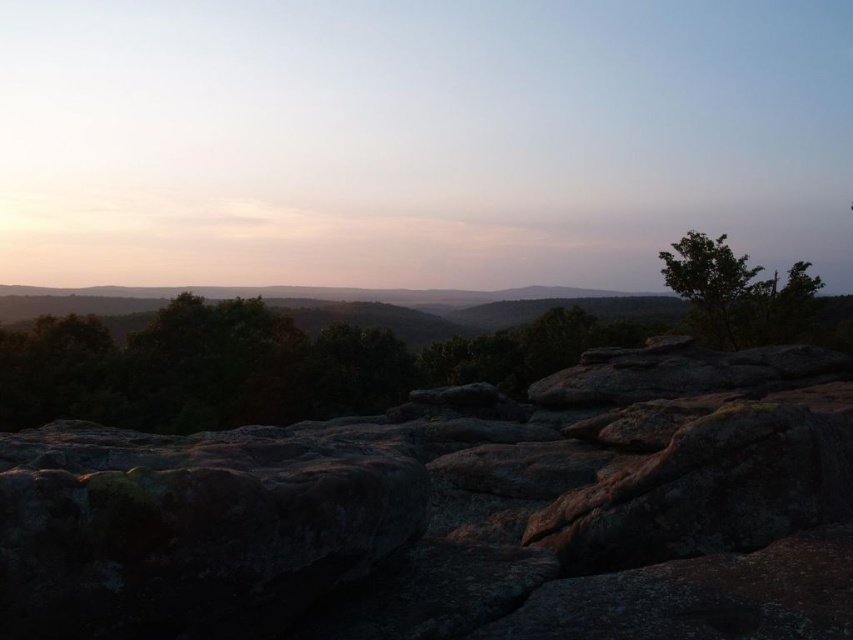
Question: Can you confirm if rusty stone boulder at center is thinner than green leafy tree at center?

Choices:
 (A) yes
 (B) no

Answer: (A)

Question: Considering the real-world distances, which object is closest to the rusty stone boulder at center?

Choices:
 (A) green leafy tree at upper right
 (B) green leafy tree at center

Answer: (A)

Question: Is rusty stone boulder at center positioned behind green leafy tree at center?

Choices:
 (A) no
 (B) yes

Answer: (A)

Question: Which object appears closest to the camera in this image?

Choices:
 (A) green leafy tree at upper right
 (B) rusty stone boulder at center

Answer: (B)

Question: In this image, where is rusty stone boulder at center located relative to green leafy tree at upper right?

Choices:
 (A) below
 (B) above

Answer: (A)

Question: Estimate the real-world distances between objects in this image. Which object is farther from the green leafy tree at upper right?

Choices:
 (A) rusty stone boulder at center
 (B) green leafy tree at center

Answer: (B)